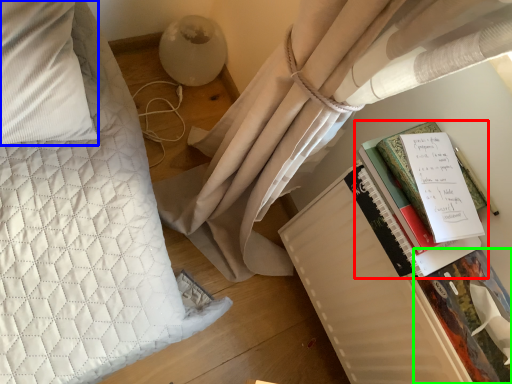
Question: Which object is positioned farthest from book (highlighted by a red box)? Select from pillow (highlighted by a blue box) and paperback book (highlighted by a green box).

Choices:
 (A) pillow
 (B) paperback book

Answer: (A)